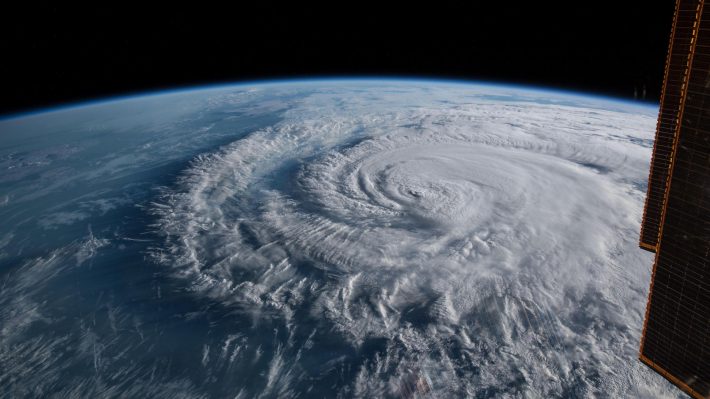
I want to click on puffs, so click(x=382, y=288), click(x=449, y=297), click(x=496, y=224), click(x=349, y=194), click(x=321, y=167), click(x=426, y=203), click(x=459, y=185).